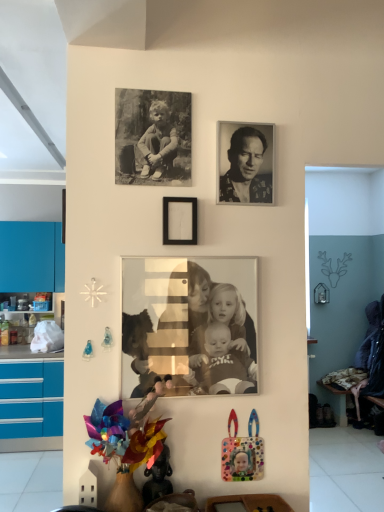
Identify the location of polka dot plastic frame at lower right, which is counted as the second toy, starting from the left. (242, 452).

Image resolution: width=384 pixels, height=512 pixels. What do you see at coordinates (189, 326) in the screenshot?
I see `sepia-toned photograph of family at center, the 2th person in the top-to-bottom sequence` at bounding box center [189, 326].

Measure the distance between black and white photograph of child at upper left, placed as the second picture frame when sorted from bottom to top, and camera.

5.05 feet.

Describe the element at coordinates (179, 221) in the screenshot. The image size is (384, 512). I see `black matte picture frame at center, which is counted as the second picture frame, starting from the top` at that location.

Locate an element on the screen. The height and width of the screenshot is (512, 384). shiny metallic figurine at center, the second toy positioned from the back is located at coordinates (158, 478).

Measure the distance between point [267,189] and camera.

Point [267,189] and camera are 1.61 meters apart.

The width and height of the screenshot is (384, 512). Find the location of `polka dot plastic frame at lower right, which is the 2th toy in front-to-back order`. polka dot plastic frame at lower right, which is the 2th toy in front-to-back order is located at coordinates (242, 452).

Considering the sizes of objects shiny metallic figurine at center, arranged as the first toy when viewed from the front, and multicolored plastic flower at lower left in the image provided, who is smaller, shiny metallic figurine at center, arranged as the first toy when viewed from the front, or multicolored plastic flower at lower left?

With smaller size is shiny metallic figurine at center, arranged as the first toy when viewed from the front.

Which is in front, shiny metallic figurine at center, which is counted as the 2th toy, starting from the right, or multicolored plastic flower at lower left?

multicolored plastic flower at lower left.

From the picture: Is shiny metallic figurine at center, placed as the first toy when sorted from left to right, to the left of multicolored plastic flower at lower left from the viewer's perspective?

No.

Does shiny metallic figurine at center, placed as the first toy when sorted from left to right, have a lesser height compared to multicolored plastic flower at lower left?

Indeed, shiny metallic figurine at center, placed as the first toy when sorted from left to right, has a lesser height compared to multicolored plastic flower at lower left.

Which of these two, polka dot plastic frame at lower right, the first toy when ordered from back to front, or black matte picture frame at center, which is counted as the second picture frame, starting from the top, stands shorter?

With less height is black matte picture frame at center, which is counted as the second picture frame, starting from the top.

What's the angular difference between polka dot plastic frame at lower right, which ranks as the first toy in right-to-left order, and black matte picture frame at center, marked as the 1th picture frame in a bottom-to-top arrangement,'s facing directions?

polka dot plastic frame at lower right, which ranks as the first toy in right-to-left order, and black matte picture frame at center, marked as the 1th picture frame in a bottom-to-top arrangement, are facing 0.805 degrees away from each other.

From a real-world perspective, is polka dot plastic frame at lower right, which is the 2th toy in front-to-back order, on top of black matte picture frame at center, marked as the 1th picture frame in a bottom-to-top arrangement?

No, from a real-world perspective, polka dot plastic frame at lower right, which is the 2th toy in front-to-back order, is not above black matte picture frame at center, marked as the 1th picture frame in a bottom-to-top arrangement.

Can you confirm if black and white photograph of a man at upper center, which appears as the first person when viewed from the top, is taller than polka dot plastic frame at lower right, the first toy when ordered from back to front?

Yes.

Is black and white photograph of a man at upper center, the 2th person ordered from the bottom, to the right of polka dot plastic frame at lower right, which is counted as the second toy, starting from the left, from the viewer's perspective?

Yes, black and white photograph of a man at upper center, the 2th person ordered from the bottom, is to the right of polka dot plastic frame at lower right, which is counted as the second toy, starting from the left.

Does black and white photograph of a man at upper center, which appears as the first person when viewed from the top, have a lesser width compared to polka dot plastic frame at lower right, which ranks as the first toy in right-to-left order?

In fact, black and white photograph of a man at upper center, which appears as the first person when viewed from the top, might be wider than polka dot plastic frame at lower right, which ranks as the first toy in right-to-left order.

Image resolution: width=384 pixels, height=512 pixels. In order to click on person behind the polka dot plastic frame at lower right, which is the 2th toy in front-to-back order in this screenshot , I will do `click(246, 169)`.

Is point (143, 106) farther from camera compared to point (133, 352)?

Yes.

The height and width of the screenshot is (512, 384). What are the coordinates of `the 2nd picture frame positioned above the sepia-toned photograph of family at center, the 2th person in the top-to-bottom sequence (from the image's perspective)` in the screenshot? It's located at (152, 137).

Would you consider black and white photograph of child at upper left, the first picture frame positioned from the top, to be distant from sepia-toned photograph of family at center, marked as the first person in a bottom-to-top arrangement?

They are positioned close to each other.

Is sepia-toned photograph of family at center, the 2th person in the top-to-bottom sequence, completely or partially inside black and white photograph of child at upper left, placed as the second picture frame when sorted from bottom to top?

No, sepia-toned photograph of family at center, the 2th person in the top-to-bottom sequence, is located outside of black and white photograph of child at upper left, placed as the second picture frame when sorted from bottom to top.

Is sepia-toned photograph of family at center, marked as the first person in a bottom-to-top arrangement, turned away from shiny metallic figurine at center, the second toy positioned from the back?

No.

Is sepia-toned photograph of family at center, the 2th person in the top-to-bottom sequence, smaller than shiny metallic figurine at center, arranged as the first toy when viewed from the front?

Actually, sepia-toned photograph of family at center, the 2th person in the top-to-bottom sequence, might be larger than shiny metallic figurine at center, arranged as the first toy when viewed from the front.

Is sepia-toned photograph of family at center, marked as the first person in a bottom-to-top arrangement, next to shiny metallic figurine at center, which is counted as the 2th toy, starting from the right?

No, sepia-toned photograph of family at center, marked as the first person in a bottom-to-top arrangement, is not with shiny metallic figurine at center, which is counted as the 2th toy, starting from the right.

Can you tell me how much black matte picture frame at center, which is counted as the second picture frame, starting from the top, and sepia-toned photograph of family at center, marked as the first person in a bottom-to-top arrangement, differ in facing direction?

The angle between the facing direction of black matte picture frame at center, which is counted as the second picture frame, starting from the top, and the facing direction of sepia-toned photograph of family at center, marked as the first person in a bottom-to-top arrangement, is 0.818 degrees.

Can you confirm if black matte picture frame at center, which is counted as the second picture frame, starting from the top, is wider than sepia-toned photograph of family at center, marked as the first person in a bottom-to-top arrangement?

Yes, black matte picture frame at center, which is counted as the second picture frame, starting from the top, is wider than sepia-toned photograph of family at center, marked as the first person in a bottom-to-top arrangement.

Would you consider black matte picture frame at center, marked as the 1th picture frame in a bottom-to-top arrangement, to be distant from sepia-toned photograph of family at center, marked as the first person in a bottom-to-top arrangement?

No, black matte picture frame at center, marked as the 1th picture frame in a bottom-to-top arrangement, is not far away from sepia-toned photograph of family at center, marked as the first person in a bottom-to-top arrangement.

From the image's perspective, is black matte picture frame at center, which is counted as the second picture frame, starting from the top, below sepia-toned photograph of family at center, the 2th person in the top-to-bottom sequence?

No.

Consider the image. Is black matte picture frame at center, marked as the 1th picture frame in a bottom-to-top arrangement, located outside shiny metallic figurine at center, which is counted as the 2th toy, starting from the right?

That's correct, black matte picture frame at center, marked as the 1th picture frame in a bottom-to-top arrangement, is outside of shiny metallic figurine at center, which is counted as the 2th toy, starting from the right.

Between black matte picture frame at center, which is counted as the second picture frame, starting from the top, and shiny metallic figurine at center, which is counted as the 2th toy, starting from the right, which one has smaller size?

Smaller between the two is black matte picture frame at center, which is counted as the second picture frame, starting from the top.

Which of these two, black matte picture frame at center, marked as the 1th picture frame in a bottom-to-top arrangement, or shiny metallic figurine at center, arranged as the first toy when viewed from the front, stands shorter?

black matte picture frame at center, marked as the 1th picture frame in a bottom-to-top arrangement, is shorter.

Is shiny metallic figurine at center, placed as the first toy when sorted from left to right, at the back of black matte picture frame at center, which is counted as the second picture frame, starting from the top?

black matte picture frame at center, which is counted as the second picture frame, starting from the top, is not turned away from shiny metallic figurine at center, placed as the first toy when sorted from left to right.

Find the location of a particular element. This screenshot has height=512, width=384. flower in front of the shiny metallic figurine at center, which is counted as the 2th toy, starting from the right is located at coordinates (123, 437).

The width and height of the screenshot is (384, 512). There is a black matte picture frame at center, marked as the 1th picture frame in a bottom-to-top arrangement. What are the coordinates of `the 1st toy below it (from the image's perspective)` in the screenshot? It's located at (242, 452).

Estimate the real-world distances between objects in this image. Which object is further from black matte picture frame at center, which is counted as the second picture frame, starting from the top, shiny metallic figurine at center, the second toy positioned from the back, or black and white photograph of a man at upper center, the 2th person ordered from the bottom?

The object further to black matte picture frame at center, which is counted as the second picture frame, starting from the top, is shiny metallic figurine at center, the second toy positioned from the back.

From the image, which object appears to be farther from polka dot plastic frame at lower right, the first toy when ordered from back to front, shiny metallic figurine at center, arranged as the first toy when viewed from the front, or black matte picture frame at center, which is counted as the second picture frame, starting from the top?

black matte picture frame at center, which is counted as the second picture frame, starting from the top, is positioned further to the anchor polka dot plastic frame at lower right, the first toy when ordered from back to front.

Estimate the real-world distances between objects in this image. Which object is further from black matte picture frame at center, marked as the 1th picture frame in a bottom-to-top arrangement, sepia-toned photograph of family at center, marked as the first person in a bottom-to-top arrangement, or multicolored plastic flower at lower left?

Among the two, multicolored plastic flower at lower left is located further to black matte picture frame at center, marked as the 1th picture frame in a bottom-to-top arrangement.

When comparing their distances from black and white photograph of a man at upper center, which appears as the first person when viewed from the top, does polka dot plastic frame at lower right, which is counted as the second toy, starting from the left, or shiny metallic figurine at center, the second toy positioned from the back, seem closer?

Among the two, polka dot plastic frame at lower right, which is counted as the second toy, starting from the left, is located nearer to black and white photograph of a man at upper center, which appears as the first person when viewed from the top.

Which object lies further to the anchor point multicolored plastic flower at lower left, sepia-toned photograph of family at center, the 2th person in the top-to-bottom sequence, or black and white photograph of a man at upper center, the 2th person ordered from the bottom?

The object further to multicolored plastic flower at lower left is black and white photograph of a man at upper center, the 2th person ordered from the bottom.

From the picture: Considering their positions, is multicolored plastic flower at lower left positioned further to black matte picture frame at center, which is counted as the second picture frame, starting from the top, than polka dot plastic frame at lower right, the first toy when ordered from back to front?

The object further to black matte picture frame at center, which is counted as the second picture frame, starting from the top, is polka dot plastic frame at lower right, the first toy when ordered from back to front.

Looking at the image, which one is located further to sepia-toned photograph of family at center, marked as the first person in a bottom-to-top arrangement, multicolored plastic flower at lower left or black and white photograph of child at upper left, the first picture frame positioned from the top?

black and white photograph of child at upper left, the first picture frame positioned from the top, lies further to sepia-toned photograph of family at center, marked as the first person in a bottom-to-top arrangement, than the other object.

Estimate the real-world distances between objects in this image. Which object is further from polka dot plastic frame at lower right, the first toy when ordered from back to front, black matte picture frame at center, marked as the 1th picture frame in a bottom-to-top arrangement, or multicolored plastic flower at lower left?

black matte picture frame at center, marked as the 1th picture frame in a bottom-to-top arrangement.

Find the location of a particular element. picture frame between black and white photograph of child at upper left, the first picture frame positioned from the top, and polka dot plastic frame at lower right, the first toy when ordered from back to front, from top to bottom is located at coordinates (179, 221).

Find the location of a particular element. picture frame that lies between black and white photograph of child at upper left, the first picture frame positioned from the top, and multicolored plastic flower at lower left from top to bottom is located at coordinates (179, 221).

You are a GUI agent. You are given a task and a screenshot of the screen. Output one action in this format:
    pyautogui.click(x=<x>, y=<y>)
    Task: Click on the flower between black and white photograph of child at upper left, placed as the second picture frame when sorted from bottom to top, and polka dot plastic frame at lower right, which is counted as the second toy, starting from the left, in the vertical direction
    Image resolution: width=384 pixels, height=512 pixels.
    Given the screenshot: What is the action you would take?
    point(123,437)

Locate an element on the screen. toy that lies between black and white photograph of child at upper left, placed as the second picture frame when sorted from bottom to top, and shiny metallic figurine at center, placed as the first toy when sorted from left to right, from top to bottom is located at coordinates (242, 452).